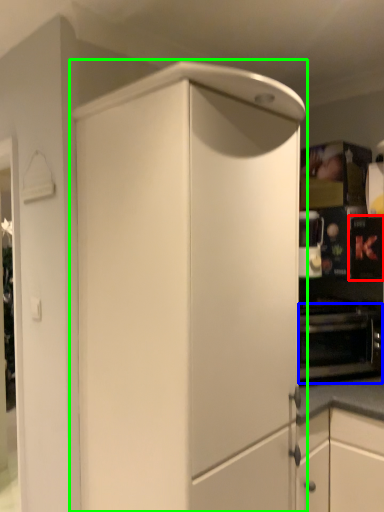
Question: Which object is the closest to the appliance (highlighted by a red box)? Choose among these: oven (highlighted by a blue box) or cabinetry (highlighted by a green box).

Choices:
 (A) oven
 (B) cabinetry

Answer: (A)